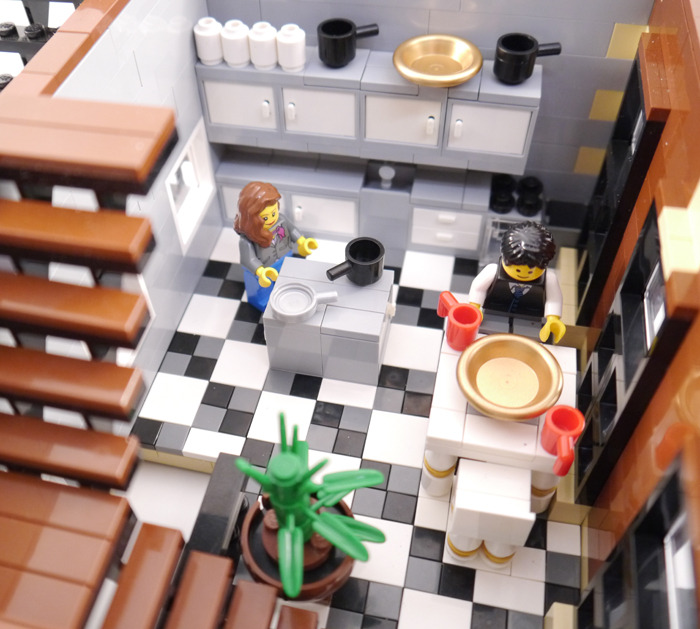
Identify the location of black mug. The image size is (700, 629). (344, 43).